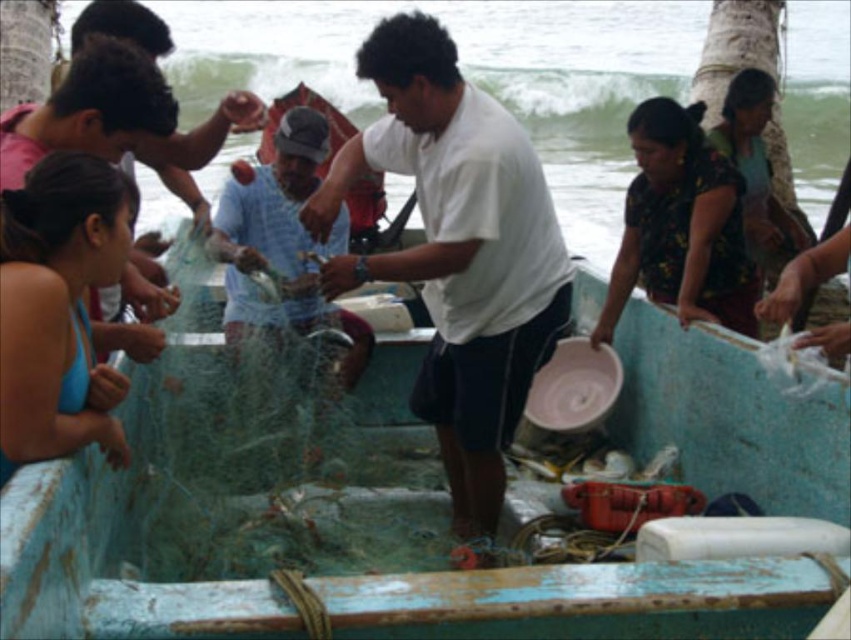
Question: Does blue painted wood boat at center have a greater width compared to translucent plastic net at center?

Choices:
 (A) yes
 (B) no

Answer: (A)

Question: Observing the image, what is the correct spatial positioning of blue painted wood boat at center in reference to white matte shirt at center?

Choices:
 (A) right
 (B) left

Answer: (B)

Question: Does white matte shirt at center lie behind translucent plastic net at center?

Choices:
 (A) yes
 (B) no

Answer: (B)

Question: Which point is closer to the camera?

Choices:
 (A) (470, 336)
 (B) (236, 630)

Answer: (B)

Question: Which of the following is the closest to the observer?

Choices:
 (A) (300, 278)
 (B) (409, 580)
 (C) (467, 420)

Answer: (B)

Question: Estimate the real-world distances between objects in this image. Which object is farther from the translucent plastic net at center?

Choices:
 (A) white matte shirt at center
 (B) blue painted wood boat at center

Answer: (A)